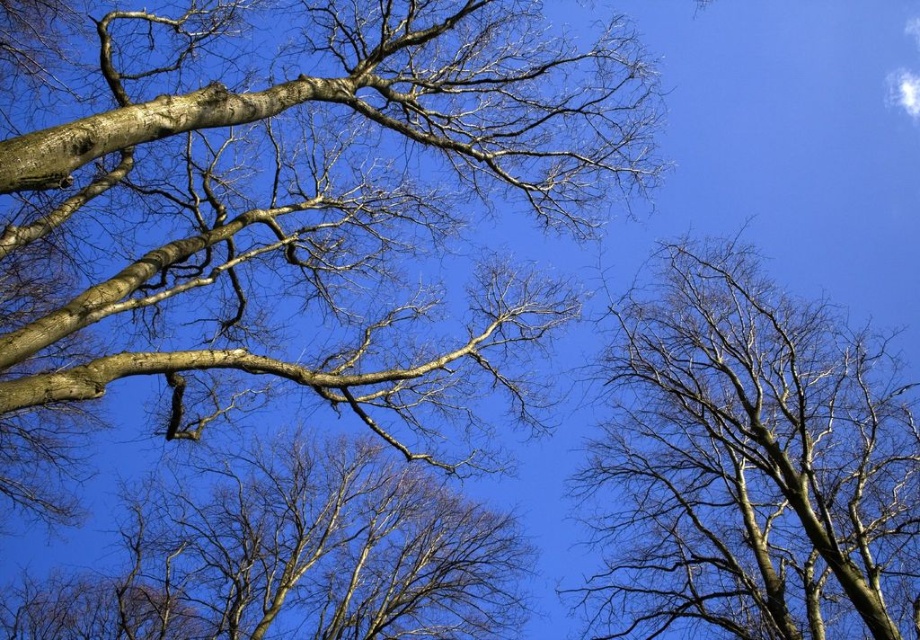
You are an artist sketching the scene of the sky framed by tree branches. You notice the smooth bark tree at upper right and the bare branches at center. Which object should you draw first if you want to follow the size order from smallest to largest?

The smooth bark tree at upper right has a smaller size compared to the bare branches at center, so you should draw the smooth bark tree at upper right first, followed by the bare branches at center.

You are lying on your back looking up at the sky through the trees. You see a smooth bark tree at upper left and a smooth bark tree at upper right. Which tree is closer to the top of your view?

The smooth bark tree at upper left is closer to the top of your view because it is positioned above the smooth bark tree at upper right.